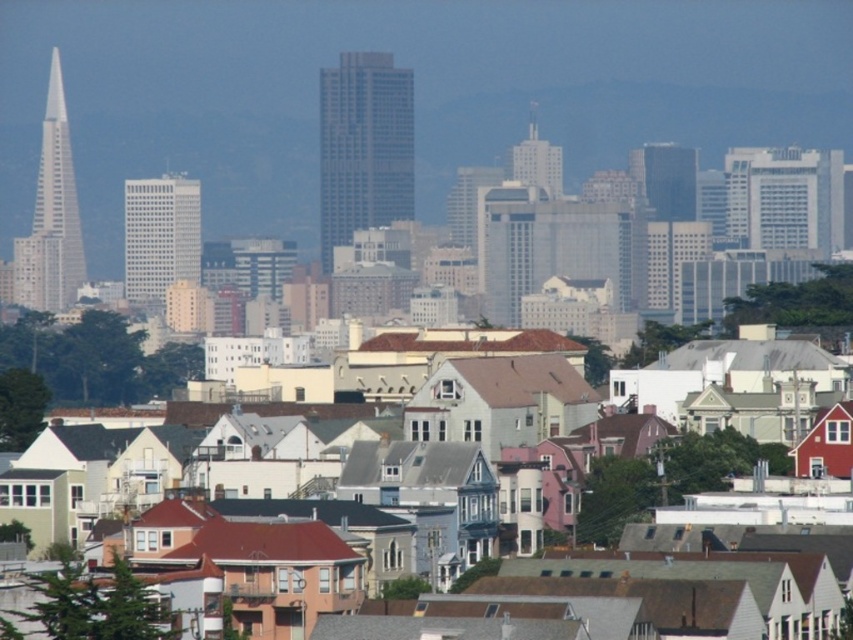
Question: Does smooth glass skyscraper at center come in front of white glass spire at left?

Choices:
 (A) yes
 (B) no

Answer: (A)

Question: Which point is farther from the camera taking this photo?

Choices:
 (A) (77, 280)
 (B) (329, 93)

Answer: (A)

Question: In this image, where is smooth glass skyscraper at center located relative to white glass spire at left?

Choices:
 (A) left
 (B) right

Answer: (B)

Question: Observing the image, what is the correct spatial positioning of smooth glass skyscraper at center in reference to white glass spire at left?

Choices:
 (A) right
 (B) left

Answer: (A)

Question: Among these points, which one is nearest to the camera?

Choices:
 (A) (50, 273)
 (B) (335, 168)

Answer: (B)

Question: Which object appears farthest from the camera in this image?

Choices:
 (A) smooth glass skyscraper at center
 (B) white glass spire at left

Answer: (B)